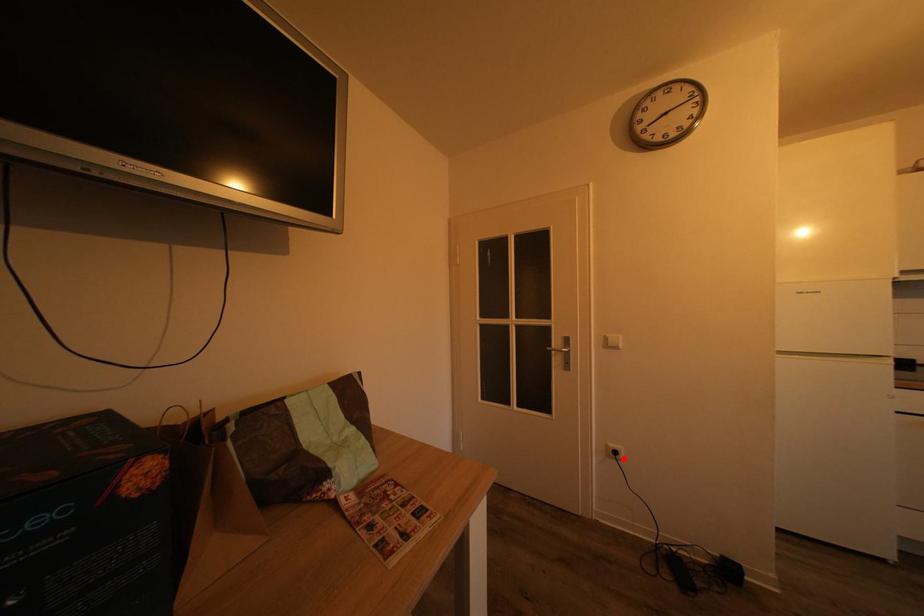
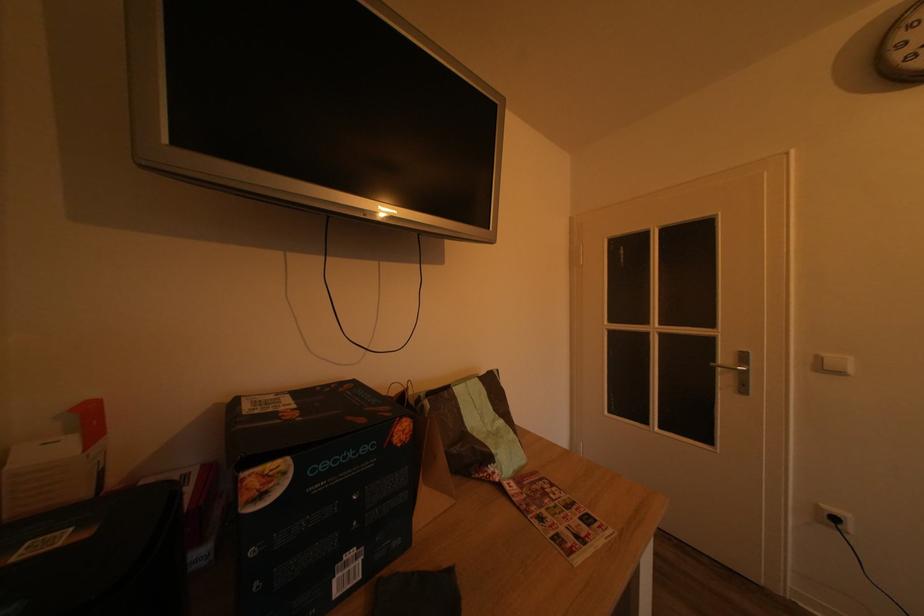
Question: A red point is marked in image1. In image2, is the corresponding 3D point closer to the camera or farther? Reply with the corresponding letter.

Choices:
 (A) The corresponding 3D point is closer.
 (B) The corresponding 3D point is farther.

Answer: (A)